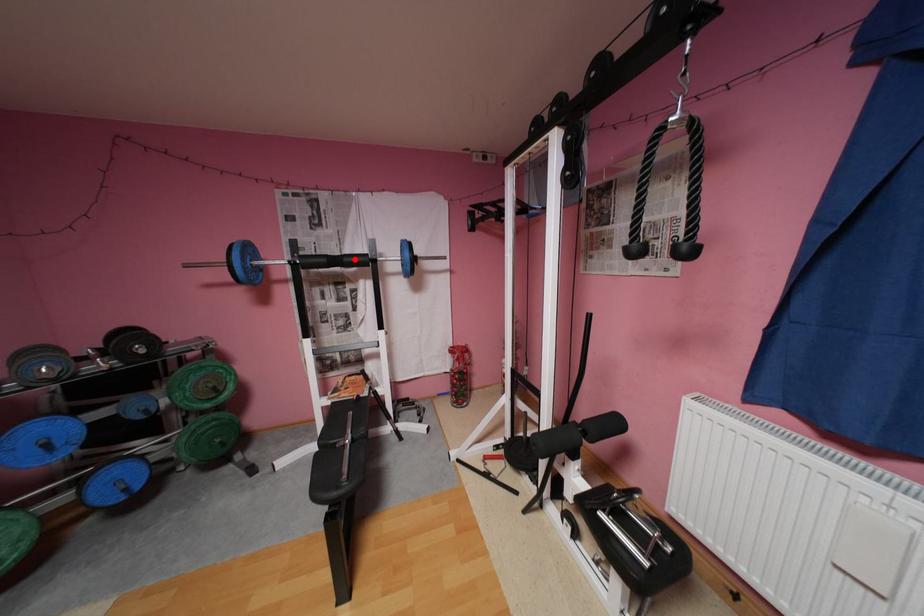
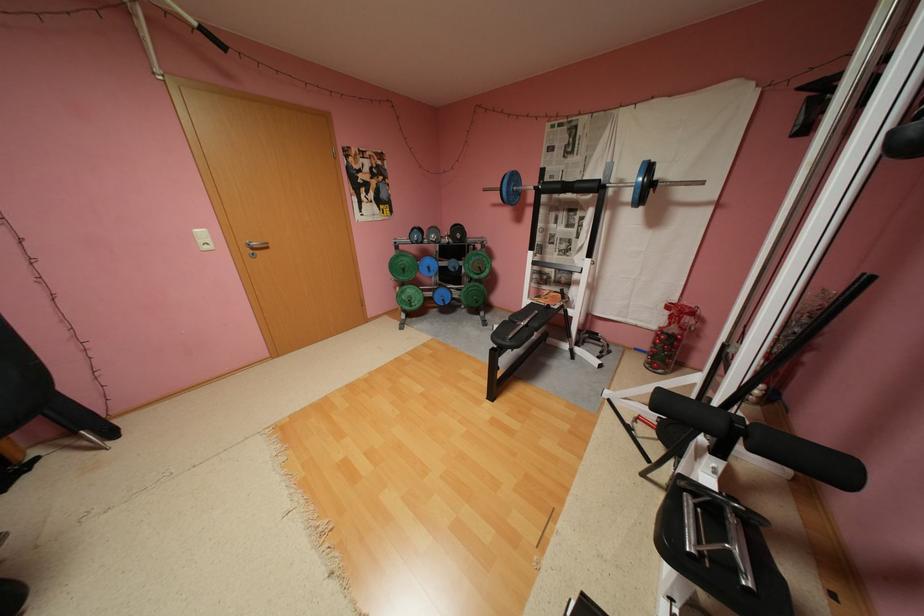
The point at the highlighted location is marked in the first image. Where is the corresponding point in the second image?

(586, 185)